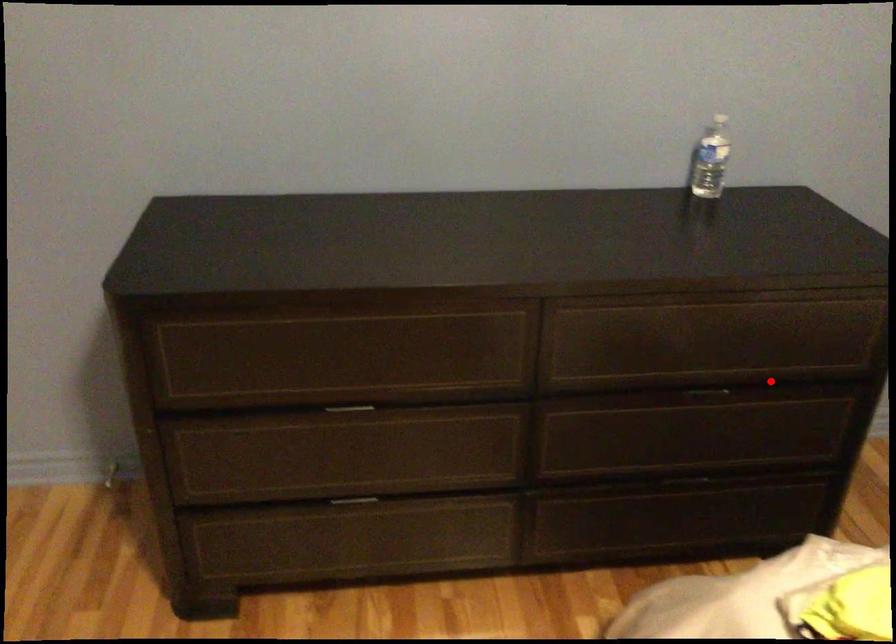
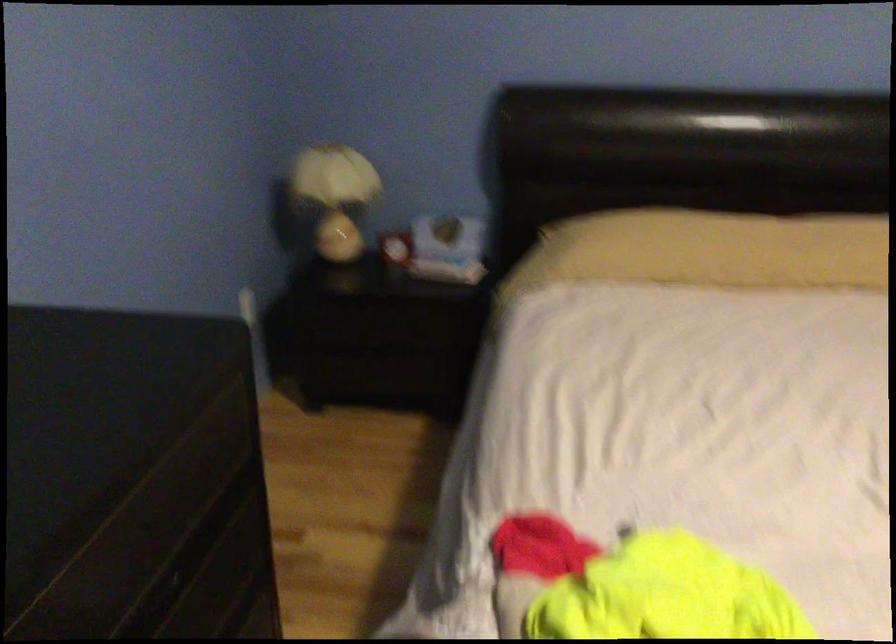
Locate, in the second image, the point that corresponds to the highlighted location in the first image.

(186, 559)